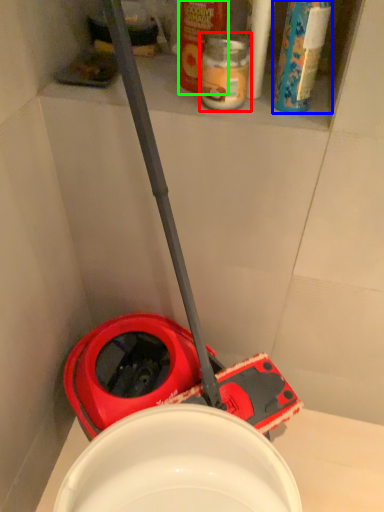
Question: Considering the real-world distances, which object is farthest from bottle (highlighted by a red box)? cleaning product (highlighted by a blue box) or cleaning product (highlighted by a green box)?

Choices:
 (A) cleaning product
 (B) cleaning product

Answer: (A)